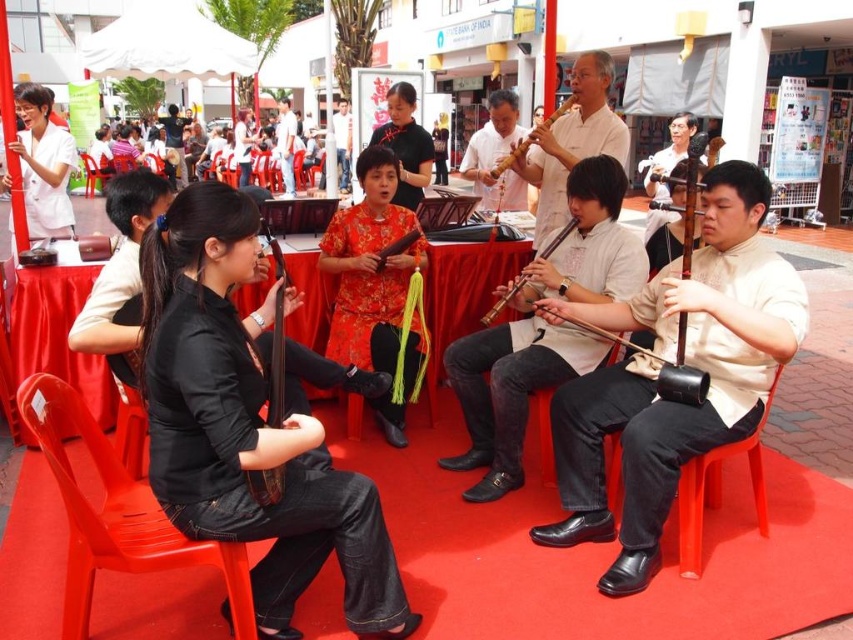
Is matte white shirt at center above red satin dress at center?

No.

Does point (618, 307) lie behind point (364, 305)?

No, (618, 307) is in front of (364, 305).

Who is more distant from viewer, [746,161] or [386,305]?

Positioned behind is point [386,305].

Locate an element on the screen. This screenshot has width=853, height=640. matte white shirt at center is located at coordinates (670, 360).

Is red plastic chair at lower left above red satin dress at center?

No.

Does red plastic chair at lower left lie behind red satin dress at center?

That is False.

What do you see at coordinates (115, 513) in the screenshot? The height and width of the screenshot is (640, 853). I see `red plastic chair at lower left` at bounding box center [115, 513].

You are a GUI agent. You are given a task and a screenshot of the screen. Output one action in this format:
    pyautogui.click(x=<x>, y=<y>)
    Task: Click on the red plastic chair at lower left
    The width and height of the screenshot is (853, 640).
    Given the screenshot: What is the action you would take?
    pyautogui.click(x=115, y=513)

Between matte white shirt at center and plastic chair at center, which one is positioned lower?

matte white shirt at center

Is point (666, 301) positioned in front of point (102, 170)?

Yes, it is in front of point (102, 170).

Who is more forward, (x=706, y=268) or (x=91, y=189)?

Point (x=706, y=268)

At what (x,y) coordinates should I click in order to perform the action: click on matte white shirt at center. Please return your answer as a coordinate pair (x, y). This screenshot has width=853, height=640. Looking at the image, I should click on (x=670, y=360).